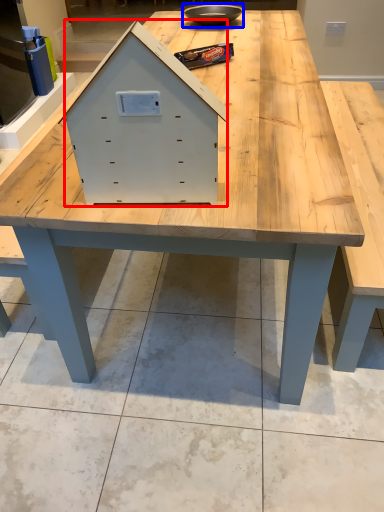
Question: Which point is further to the camera, drawer (highlighted by a red box) or bowl (highlighted by a blue box)?

Choices:
 (A) drawer
 (B) bowl

Answer: (B)